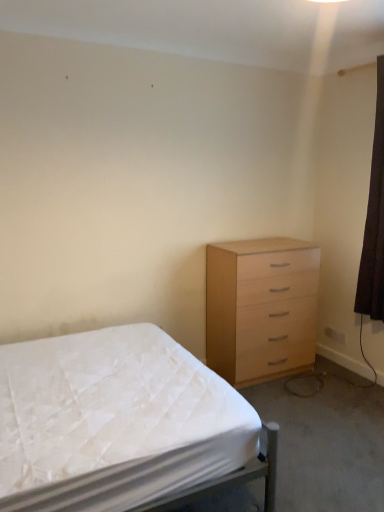
The height and width of the screenshot is (512, 384). I want to click on free point below brown fabric curtain at right (from a real-world perspective), so click(365, 379).